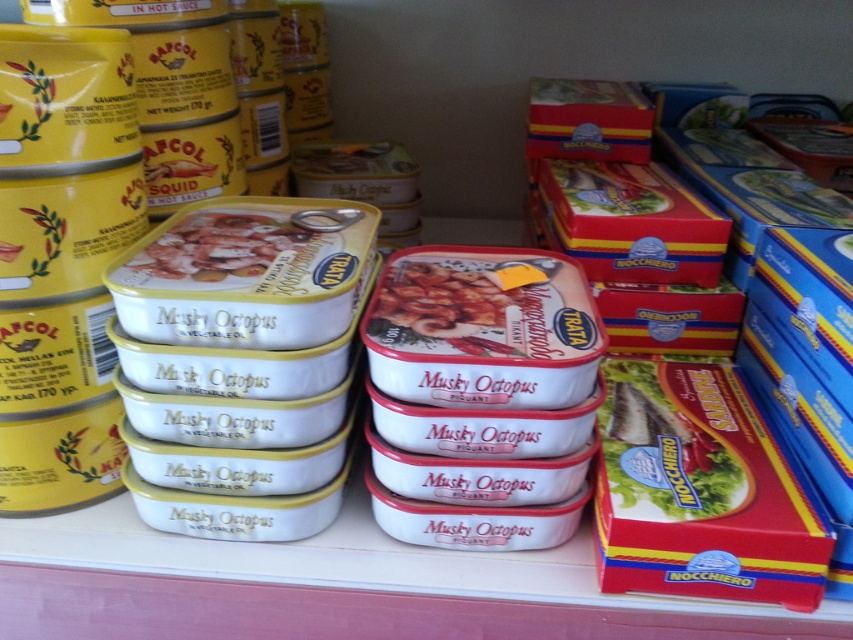
You are looking at the shelf with the Musky Octopus cans and Squid in Hot Sauce tins. There are two points marked on the shelf. Which point is closer to you, point (772, 518) or point (401, 317)?

Point (772, 518) is closer to the viewer than point (401, 317).